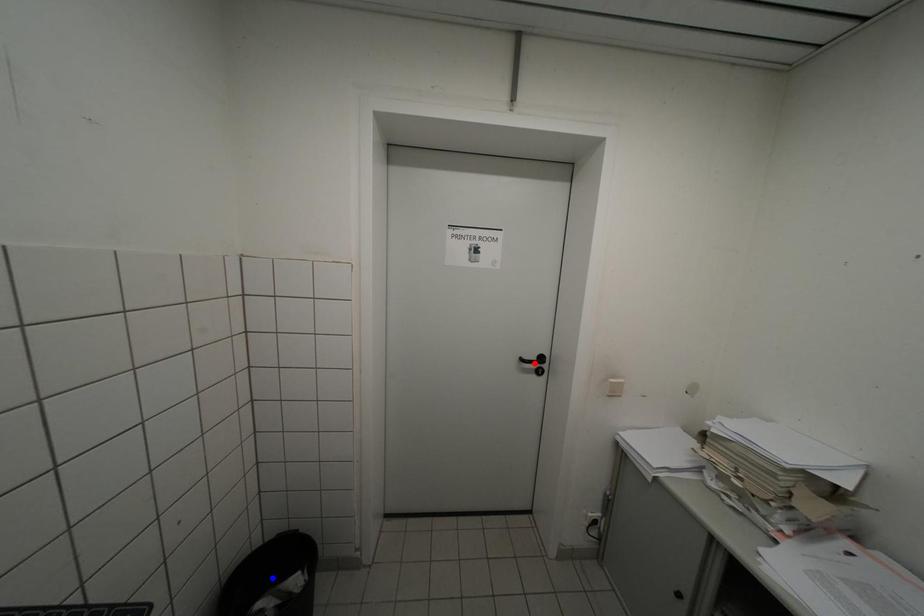
Question: Which of the two points in the image is closer to the camera?

Choices:
 (A) Blue point is closer.
 (B) Red point is closer.

Answer: (A)